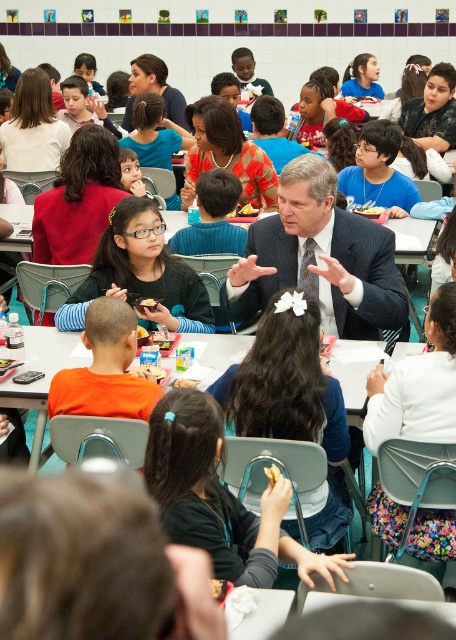
Question: Among these objects, which one is farthest from the camera?

Choices:
 (A) matte black sweater at center
 (B) white matte sandwich at center
 (C) golden crispy pastry at center

Answer: (A)

Question: Can you confirm if matte black sweater at center is positioned below white matte sandwich at center?

Choices:
 (A) no
 (B) yes

Answer: (A)

Question: Which point is farther to the camera?

Choices:
 (A) matte black sweater at center
 (B) white matte sandwich at center

Answer: (A)

Question: Is the position of white plastic table at center more distant than that of golden crispy pastry at center?

Choices:
 (A) yes
 (B) no

Answer: (A)

Question: Which point appears closest to the camera in this image?

Choices:
 (A) (253, 211)
 (B) (133, 371)
 (C) (276, 474)
 (D) (186, 385)

Answer: (C)

Question: Does yellowish matte sandwich at center appear over golden crispy french fries at center?

Choices:
 (A) no
 (B) yes

Answer: (A)